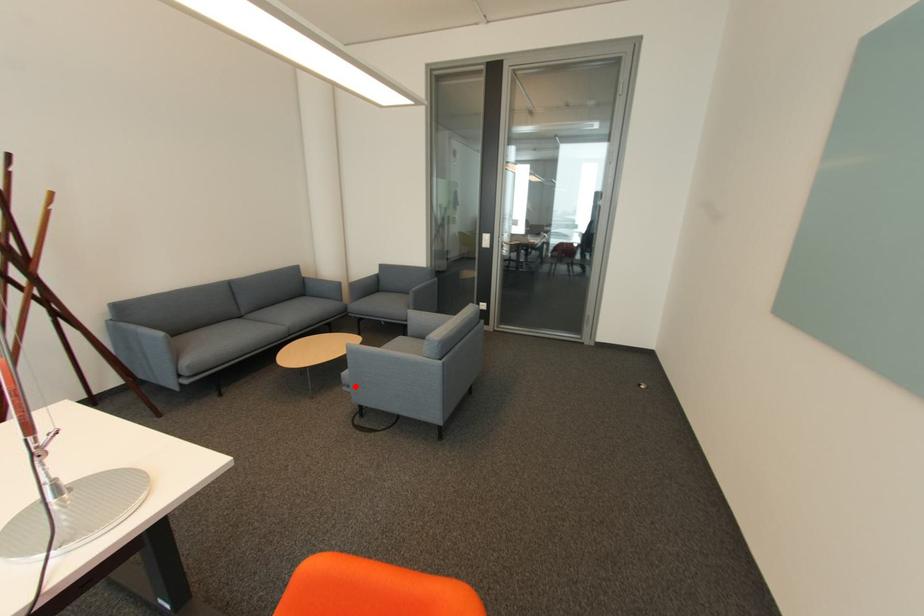
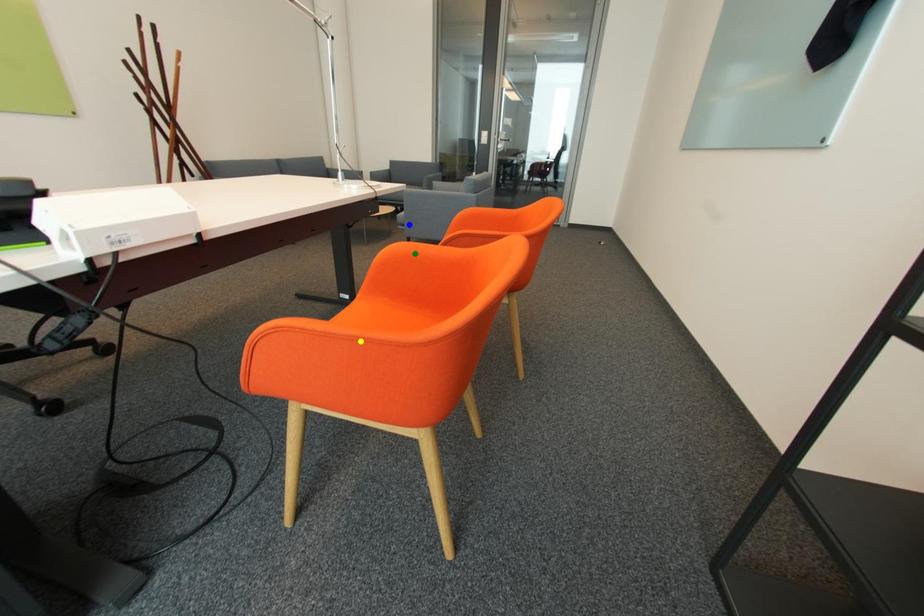
Question: I am providing you with two images of the same scene from different viewpoints. A red point is marked on the first image. You are given multiple points on the second image. Which point in image 2 represents the same 3d spot as the red point in image 1?

Choices:
 (A) blue point
 (B) green point
 (C) yellow point

Answer: (A)